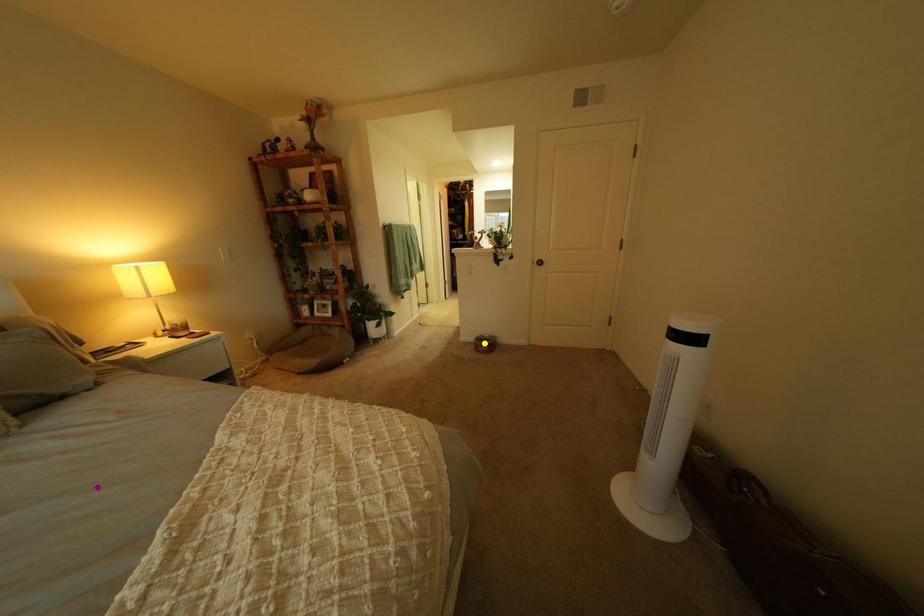
Order these from nearest to farthest:
1. yellow point
2. orange point
3. purple point

purple point < orange point < yellow point